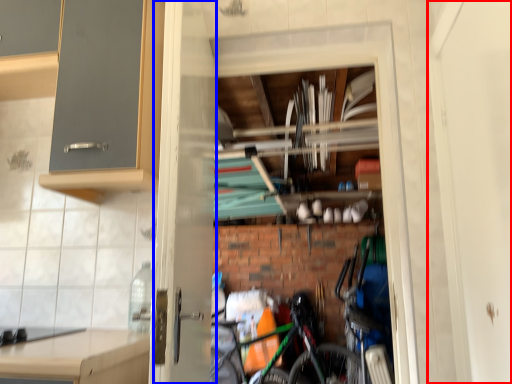
Question: Which of the following is the farthest to the observer, screen door (highlighted by a red box) or screen door (highlighted by a blue box)?

Choices:
 (A) screen door
 (B) screen door

Answer: (B)